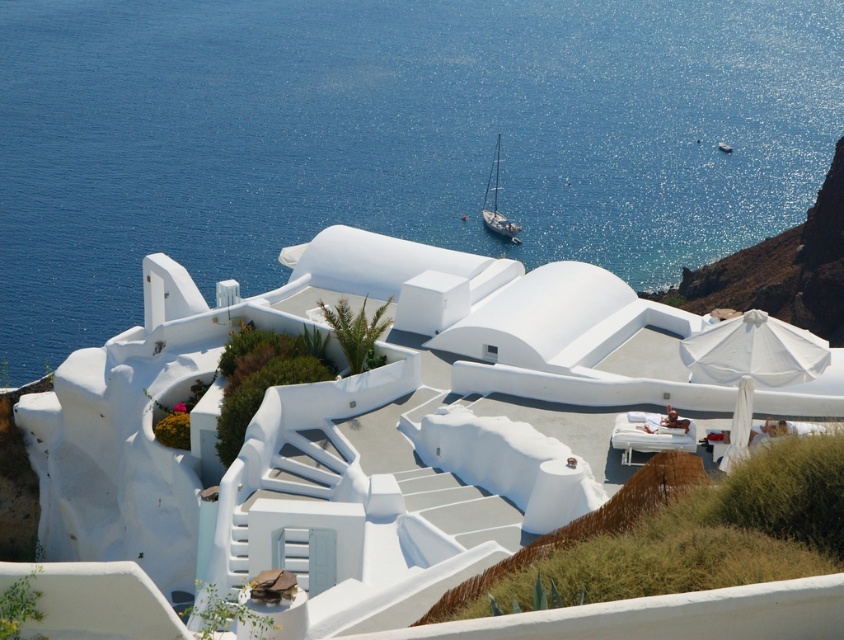
You are standing on the main terrace of the coastal resort and see the blue water at center and the blue glossy sailboat at center. Which object is nearer to you?

The blue water at center is closer to the viewer than the blue glossy sailboat at center.

You are a tour guide leading a group to the beach area. You see the blue water at center and the blue glossy sailboat at center. The group wants to know how far they need to walk to reach the water from the sailboat. Can you tell them?

The blue water at center and blue glossy sailboat at center are 54.58 meters apart, so the group needs to walk approximately 54.58 meters to reach the water from the sailboat.

You are standing on the main terrace of the coastal resort and want to take a photo of both the point at coordinates point (327, 154) and point (488, 225). Which point will appear closer to the camera in the photo?

Point (327, 154) is further to the camera than point (488, 225), so point (488, 225) will appear closer to the camera in the photo.